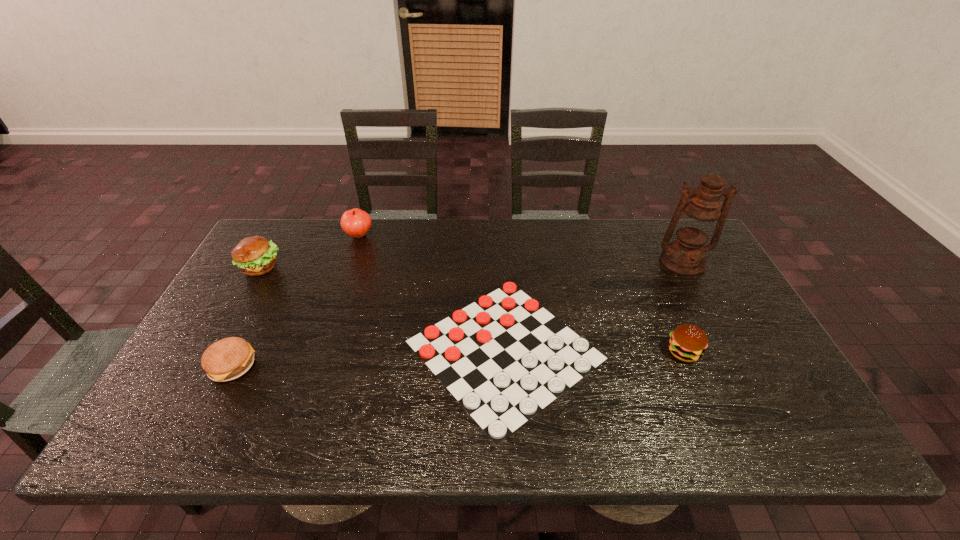
Locate an element on the screen. The height and width of the screenshot is (540, 960). object located at the far left corner is located at coordinates coord(255,255).

The height and width of the screenshot is (540, 960). I want to click on object located in the far right corner section of the desktop, so click(x=696, y=220).

At what (x,y) coordinates should I click in order to perform the action: click on vacant region at the far edge of the desktop. Please return your answer as a coordinate pair (x, y). Image resolution: width=960 pixels, height=540 pixels. Looking at the image, I should click on (631, 260).

Find the location of a particular element. vacant point at the near edge is located at coordinates (426, 414).

You are a GUI agent. You are given a task and a screenshot of the screen. Output one action in this format:
    pyautogui.click(x=<x>, y=<y>)
    Task: Click on the vacant space at the left edge of the desktop
    This screenshot has height=540, width=960.
    Given the screenshot: What is the action you would take?
    pyautogui.click(x=270, y=296)

Locate an element on the screen. vacant space at the right edge of the desktop is located at coordinates (708, 329).

Find the location of a particular element. The height and width of the screenshot is (540, 960). vacant area at the far right corner of the desktop is located at coordinates (658, 226).

Where is `free space between the tallest hamburger and the checkerboard`? This screenshot has height=540, width=960. free space between the tallest hamburger and the checkerboard is located at coordinates (383, 308).

Locate an element on the screen. The image size is (960, 540). blank region between the tallest object and the checkerboard is located at coordinates (593, 306).

Locate an element on the screen. This screenshot has width=960, height=540. free space that is in between the shortest hamburger and the farthest object is located at coordinates (296, 301).